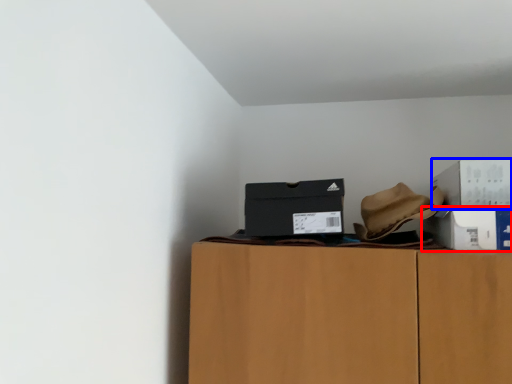
Question: Which of the following is the farthest to the observer, box (highlighted by a red box) or box (highlighted by a blue box)?

Choices:
 (A) box
 (B) box

Answer: (A)